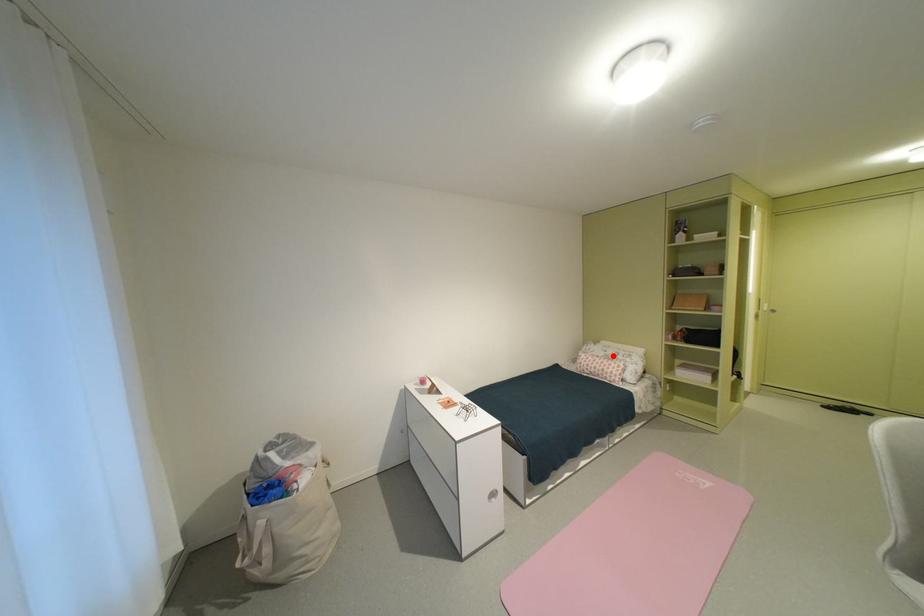
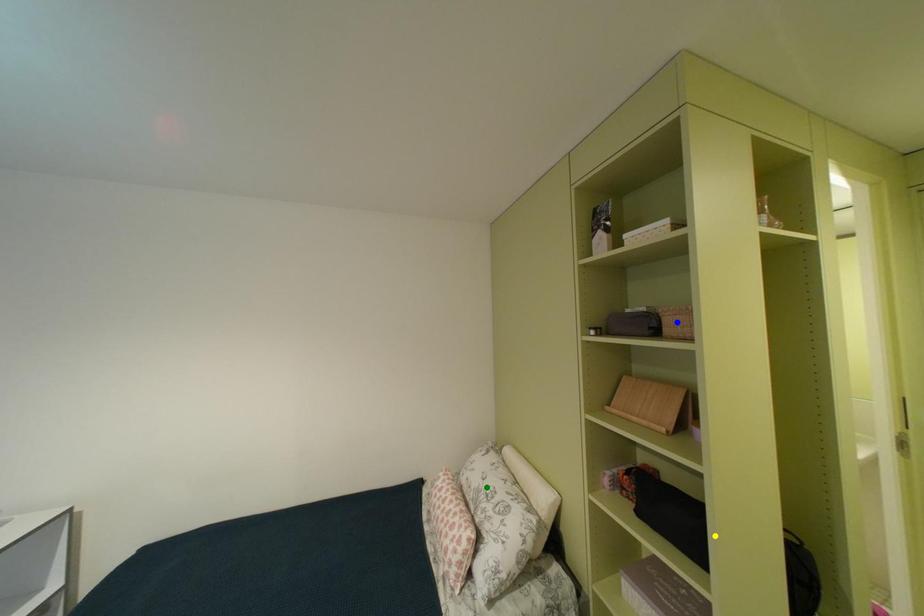
Question: I am providing you with two images of the same scene from different viewpoints. A red point is marked on the first image. You are given multiple points on the second image. Which mark in image 2 goes with the point in image 1?

Choices:
 (A) green point
 (B) blue point
 (C) yellow point

Answer: (A)